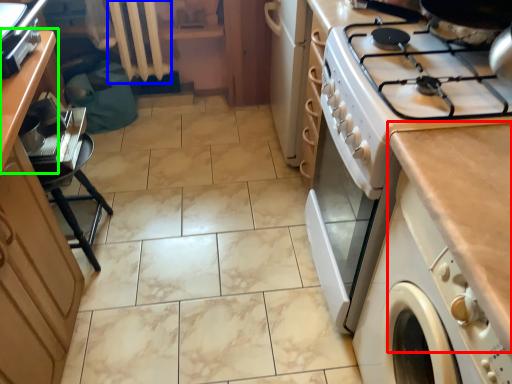
Question: Based on their relative distances, which object is nearer to countertop (highlighted by a red box)? Choose from radiator (highlighted by a blue box) and counter (highlighted by a green box).

Choices:
 (A) radiator
 (B) counter

Answer: (B)